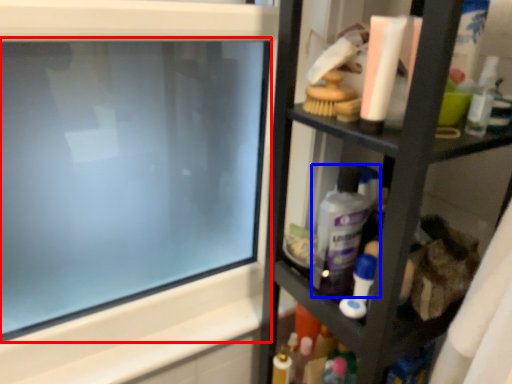
Question: Which point is closer to the camera, computer screen (highlighted by a red box) or cleaning product (highlighted by a blue box)?

Choices:
 (A) computer screen
 (B) cleaning product

Answer: (A)